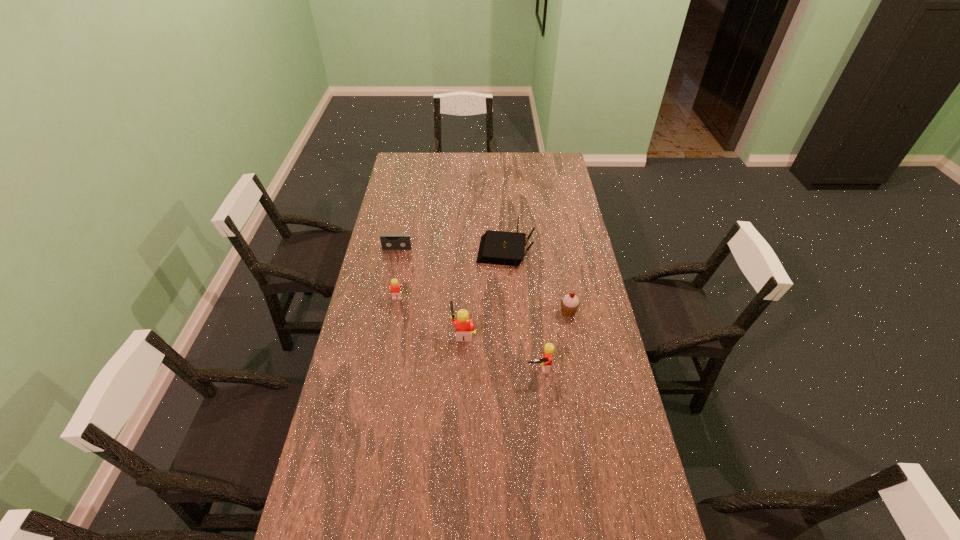
Where is `the shortest Lego`? the shortest Lego is located at coordinates tap(396, 289).

Image resolution: width=960 pixels, height=540 pixels. Identify the location of the farthest Lego. (396, 289).

Where is `the tallest object`? The image size is (960, 540). the tallest object is located at coordinates click(464, 326).

The width and height of the screenshot is (960, 540). What are the coordinates of `the second farthest Lego` in the screenshot? It's located at (464, 326).

The height and width of the screenshot is (540, 960). I want to click on the second tallest Lego, so click(x=546, y=362).

The height and width of the screenshot is (540, 960). I want to click on the nearest Lego, so click(546, 362).

This screenshot has width=960, height=540. Identify the location of router. (496, 247).

Locate an element on the screen. videotape is located at coordinates (388, 241).

Image resolution: width=960 pixels, height=540 pixels. Identify the location of cupcake. (570, 303).

Locate an element on the screen. The width and height of the screenshot is (960, 540). free space located in front of the leftmost Lego with the accessory visible is located at coordinates (468, 301).